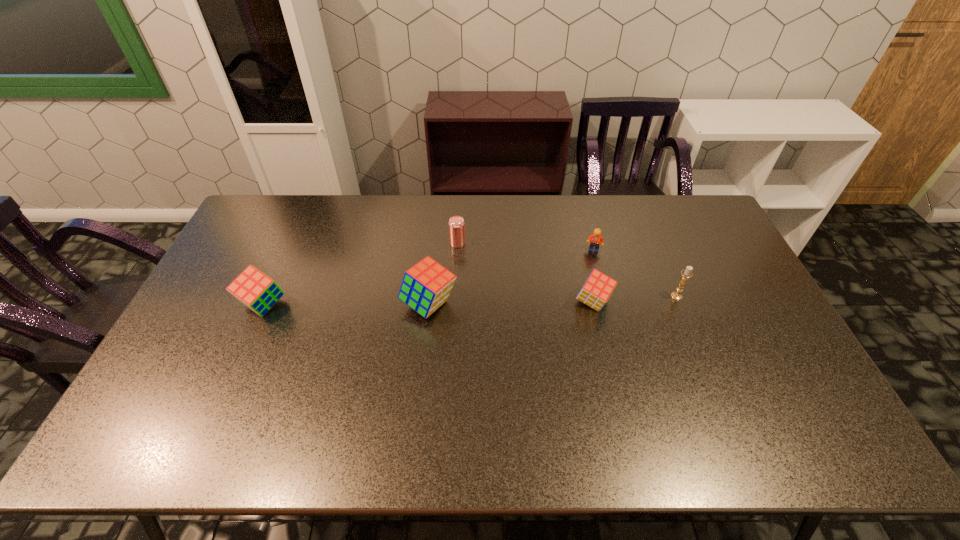
Locate which cube is the closest to the Lego. Please provide its 2D coordinates. Your answer should be formatted as a tuple, i.e. [(x, y)], where the tuple contains the x and y coordinates of a point satisfying the conditions above.

[(597, 289)]

Choose which cube is the second nearest neighbor to the second shortest cube. Please provide its 2D coordinates. Your answer should be formatted as a tuple, i.e. [(x, y)], where the tuple contains the x and y coordinates of a point satisfying the conditions above.

[(597, 289)]

Find the location of a particular element. The height and width of the screenshot is (540, 960). free space that satisfies the following two spatial constraints: 1. on the back side of the candle holder; 2. on the left side of the leftmost cube is located at coordinates (268, 296).

Locate an element on the screen. vacant region that satisfies the following two spatial constraints: 1. on the back side of the shortest cube; 2. on the right side of the second cube from right to left is located at coordinates (429, 302).

Locate an element on the screen. The width and height of the screenshot is (960, 540). free space that satisfies the following two spatial constraints: 1. on the back side of the beer can; 2. on the left side of the leftmost cube is located at coordinates (292, 243).

Locate an element on the screen. This screenshot has width=960, height=540. blank area in the image that satisfies the following two spatial constraints: 1. on the front-facing side of the Lego; 2. on the left side of the rightmost object is located at coordinates (606, 296).

You are a GUI agent. You are given a task and a screenshot of the screen. Output one action in this format:
    pyautogui.click(x=<x>, y=<y>)
    Task: Click on the free space that satisfies the following two spatial constraints: 1. on the back side of the beer can; 2. on the left side of the leftmost object
    The width and height of the screenshot is (960, 540).
    Given the screenshot: What is the action you would take?
    pyautogui.click(x=292, y=243)

You are a GUI agent. You are given a task and a screenshot of the screen. Output one action in this format:
    pyautogui.click(x=<x>, y=<y>)
    Task: Click on the free spot that satisfies the following two spatial constraints: 1. on the front-facing side of the rightmost object; 2. on the right side of the Lego
    
    Given the screenshot: What is the action you would take?
    pyautogui.click(x=606, y=296)